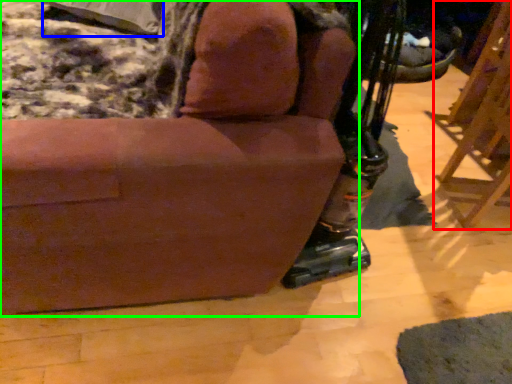
Question: Which object is the farthest from furniture (highlighted by a red box)? Choose among these: pillow (highlighted by a blue box) or chair (highlighted by a green box).

Choices:
 (A) pillow
 (B) chair

Answer: (A)